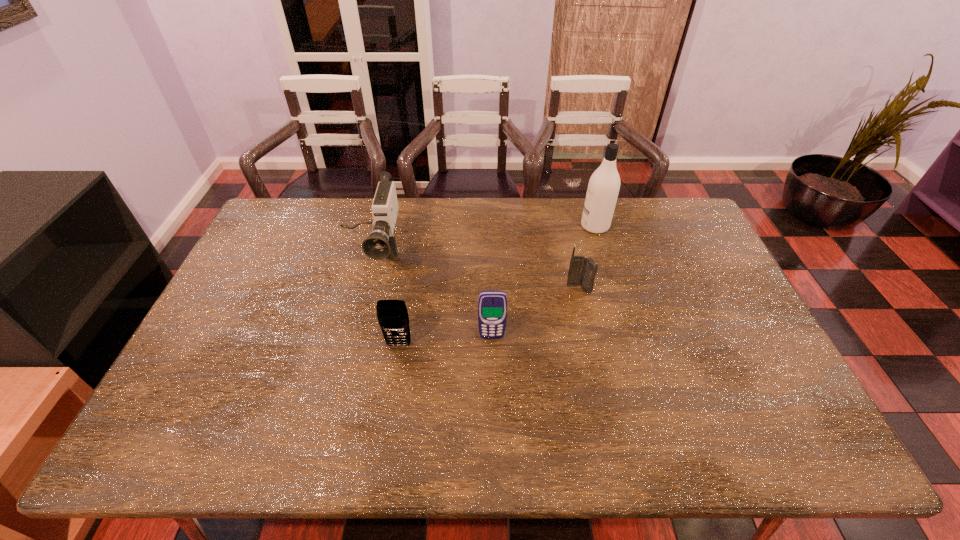
Locate an element on the screen. The width and height of the screenshot is (960, 540). vacant space in between the second cellular telephone from left to right and the camcorder is located at coordinates (431, 296).

Identify the location of free space between the fourth object from left to right and the second cellular telephone from right to left. The height and width of the screenshot is (540, 960). (536, 313).

At what (x,y) coordinates should I click in order to perform the action: click on object that is the third closest to the nearest object. Please return your answer as a coordinate pair (x, y). This screenshot has height=540, width=960. Looking at the image, I should click on (582, 271).

Identify the location of object that stands as the closest to the tallest object. The height and width of the screenshot is (540, 960). (582, 271).

You are a GUI agent. You are given a task and a screenshot of the screen. Output one action in this format:
    pyautogui.click(x=<x>, y=<y>)
    Task: Click on the cellular telephone that is the nearest to the farthest cellular telephone
    This screenshot has height=540, width=960.
    Given the screenshot: What is the action you would take?
    pyautogui.click(x=492, y=305)

Select which cellular telephone is the second closest to the fourth shortest object. Please provide its 2D coordinates. Your answer should be formatted as a tuple, i.e. [(x, y)], where the tuple contains the x and y coordinates of a point satisfying the conditions above.

[(492, 305)]

You are a GUI agent. You are given a task and a screenshot of the screen. Output one action in this format:
    pyautogui.click(x=<x>, y=<y>)
    Task: Click on the vacant space that satisfies the following two spatial constraints: 1. on the front-facing side of the rightmost object; 2. on the screen of the nearest cellular telephone
    
    Given the screenshot: What is the action you would take?
    pyautogui.click(x=630, y=345)

You are a GUI agent. You are given a task and a screenshot of the screen. Output one action in this format:
    pyautogui.click(x=<x>, y=<y>)
    Task: Click on the vacant point that satisfies the following two spatial constraints: 1. on the front-facing side of the shampoo; 2. on the recording direction of the camcorder
    Image resolution: width=960 pixels, height=540 pixels.
    Given the screenshot: What is the action you would take?
    pyautogui.click(x=603, y=255)